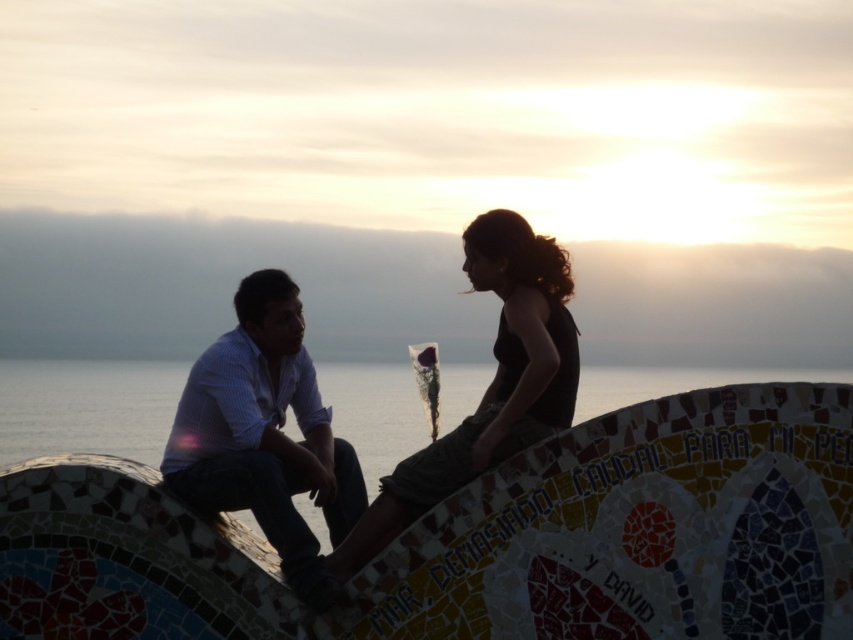
Is the position of matte white shirt at left less distant than that of silhouette fabric at center?

Yes.

Who is lower down, matte white shirt at left or silhouette fabric at center?

Positioned lower is matte white shirt at left.

What do you see at coordinates (265, 435) in the screenshot? This screenshot has width=853, height=640. I see `matte white shirt at left` at bounding box center [265, 435].

Identify the location of matte white shirt at left. (265, 435).

Can you confirm if transparent glass water at center is positioned below silhouette fabric at center?

Indeed, transparent glass water at center is positioned under silhouette fabric at center.

Based on the photo, does transparent glass water at center appear on the left side of silhouette fabric at center?

No, transparent glass water at center is not to the left of silhouette fabric at center.

Describe the element at coordinates (86, 406) in the screenshot. The width and height of the screenshot is (853, 640). I see `transparent glass water at center` at that location.

Image resolution: width=853 pixels, height=640 pixels. I want to click on transparent glass water at center, so click(86, 406).

Consider the image. Is matte white shirt at left positioned in front of transparent glass water at center?

Yes.

Who is shorter, matte white shirt at left or transparent glass water at center?

With less height is transparent glass water at center.

Is point (311, 541) farther from viewer compared to point (154, 374)?

No, it is not.

Find the location of a particular element. matte white shirt at left is located at coordinates (265, 435).